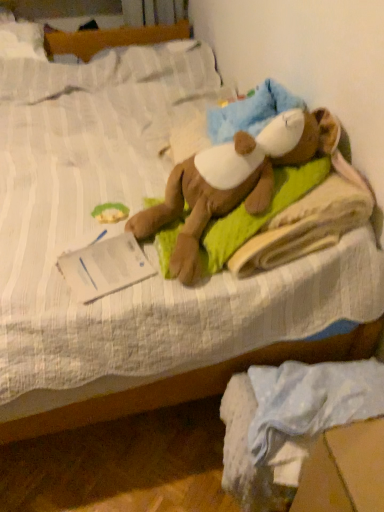
Question: Does soft brown plush toy at center have a larger size compared to green fabric at upper left?

Choices:
 (A) yes
 (B) no

Answer: (A)

Question: Is soft brown plush toy at center looking in the opposite direction of green fabric at upper left?

Choices:
 (A) no
 (B) yes

Answer: (A)

Question: Considering the relative sizes of soft brown plush toy at center and green fabric at upper left in the image provided, is soft brown plush toy at center shorter than green fabric at upper left?

Choices:
 (A) no
 (B) yes

Answer: (A)

Question: Is soft brown plush toy at center outside green fabric at upper left?

Choices:
 (A) no
 (B) yes

Answer: (B)

Question: Is soft brown plush toy at center at the left side of green fabric at upper left?

Choices:
 (A) no
 (B) yes

Answer: (A)

Question: Which is correct: soft brown plush toy at center is inside white cotton fabric at lower right, or outside of it?

Choices:
 (A) inside
 (B) outside

Answer: (B)

Question: From a real-world perspective, relative to white cotton fabric at lower right, is soft brown plush toy at center vertically above or below?

Choices:
 (A) below
 (B) above

Answer: (B)

Question: Relative to white cotton fabric at lower right, is soft brown plush toy at center in front or behind?

Choices:
 (A) behind
 (B) front

Answer: (A)

Question: Is point (155, 224) positioned closer to the camera than point (347, 382)?

Choices:
 (A) closer
 (B) farther

Answer: (B)

Question: Is white cotton fabric at lower right taller or shorter than green fabric at upper left?

Choices:
 (A) tall
 (B) short

Answer: (A)

Question: From the image's perspective, is white cotton fabric at lower right positioned above or below green fabric at upper left?

Choices:
 (A) below
 (B) above

Answer: (A)

Question: From a real-world perspective, is white cotton fabric at lower right positioned above or below green fabric at upper left?

Choices:
 (A) below
 (B) above

Answer: (A)

Question: Considering the positions of white cotton fabric at lower right and green fabric at upper left in the image, is white cotton fabric at lower right bigger or smaller than green fabric at upper left?

Choices:
 (A) small
 (B) big

Answer: (B)

Question: In terms of height, does soft brown plush toy at center look taller or shorter compared to green fabric at upper left?

Choices:
 (A) short
 (B) tall

Answer: (B)

Question: From a real-world perspective, is soft brown plush toy at center above or below green fabric at upper left?

Choices:
 (A) above
 (B) below

Answer: (A)